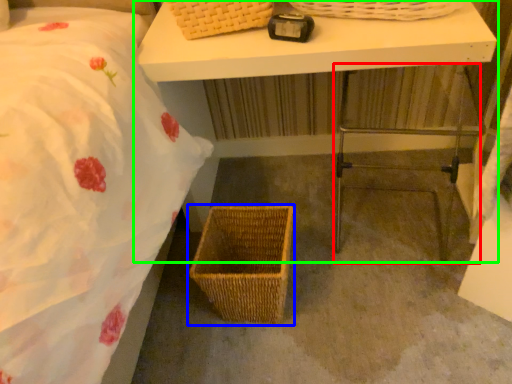
Question: Which object is the closest to the step stool (highlighted by a red box)? Choose among these: picnic basket (highlighted by a blue box) or table (highlighted by a green box).

Choices:
 (A) picnic basket
 (B) table

Answer: (B)